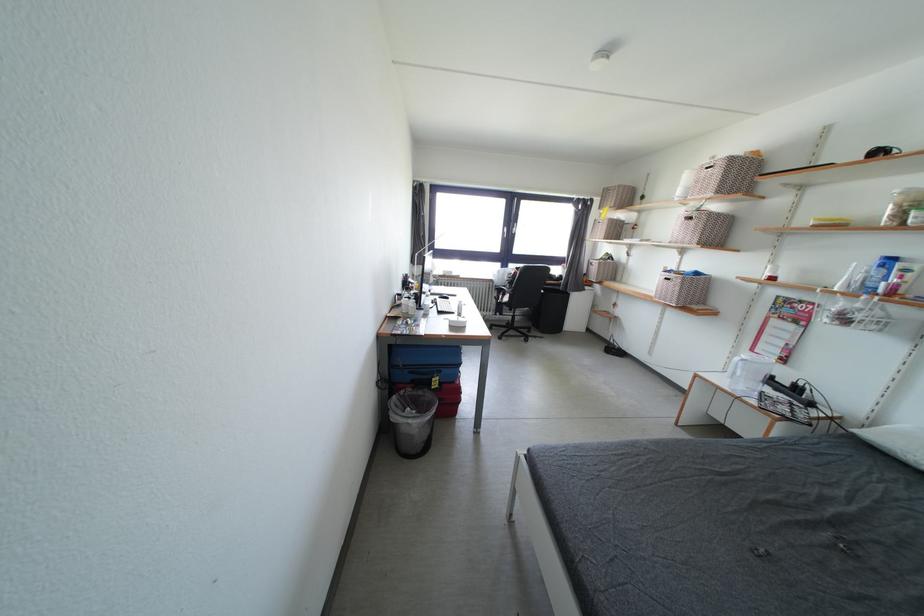
Image resolution: width=924 pixels, height=616 pixels. What do you see at coordinates (896, 442) in the screenshot?
I see `the white pillow` at bounding box center [896, 442].